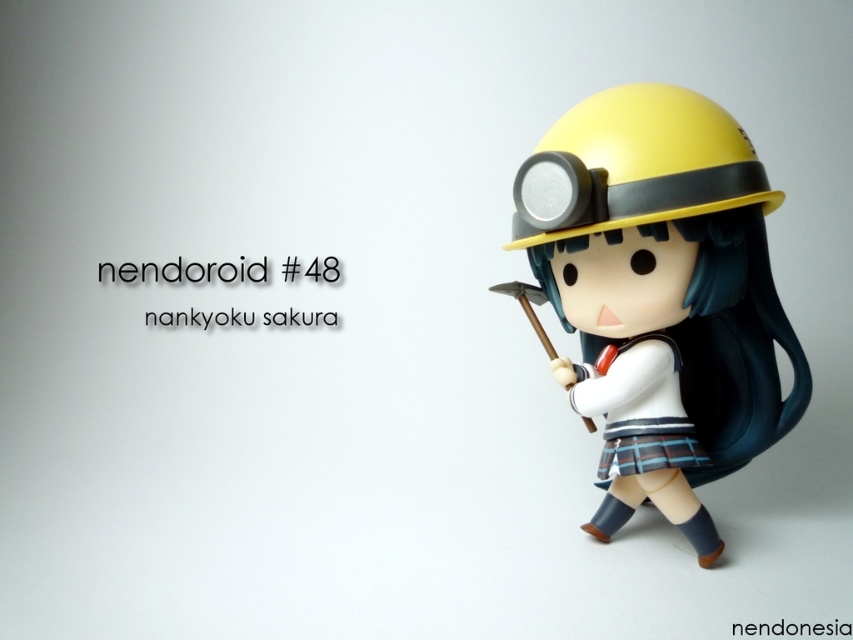
Question: Does matte yellow helmet at upper right have a greater width compared to yellow matte helmet at upper center?

Choices:
 (A) yes
 (B) no

Answer: (A)

Question: Does matte yellow helmet at upper right have a smaller size compared to yellow matte helmet at upper center?

Choices:
 (A) yes
 (B) no

Answer: (B)

Question: Which point is farther to the camera?

Choices:
 (A) matte yellow helmet at upper right
 (B) yellow matte helmet at upper center

Answer: (A)

Question: In this image, where is matte yellow helmet at upper right located relative to yellow matte helmet at upper center?

Choices:
 (A) above
 (B) below

Answer: (B)

Question: Which of the following is the farthest from the observer?

Choices:
 (A) (604, 253)
 (B) (683, 184)

Answer: (A)